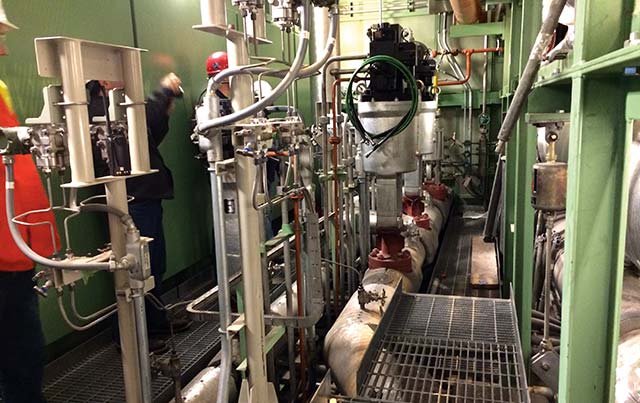
Where is `rack`? Image resolution: width=640 pixels, height=403 pixels. rack is located at coordinates (418, 366).